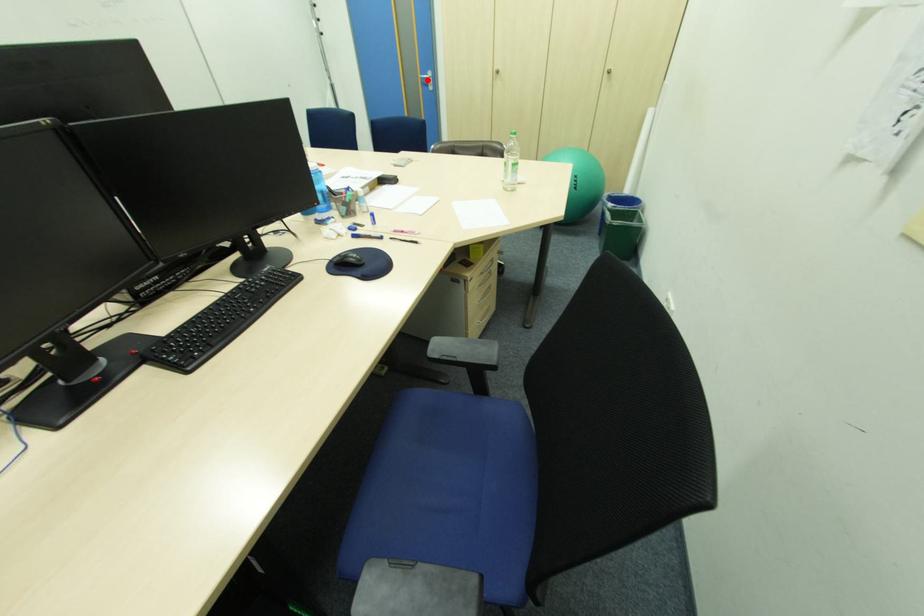
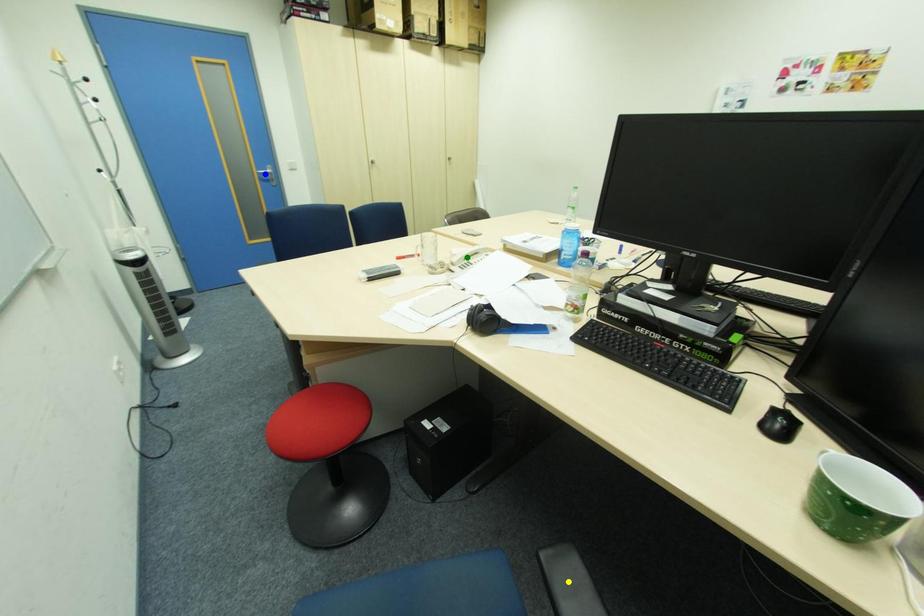
Question: I am providing you with two images of the same scene from different viewpoints. A red point is marked on the first image. You are given multiple points on the second image. Can you choose the point in image 2 that corresponds to the point in image 1?

Choices:
 (A) yellow point
 (B) green point
 (C) blue point

Answer: (C)